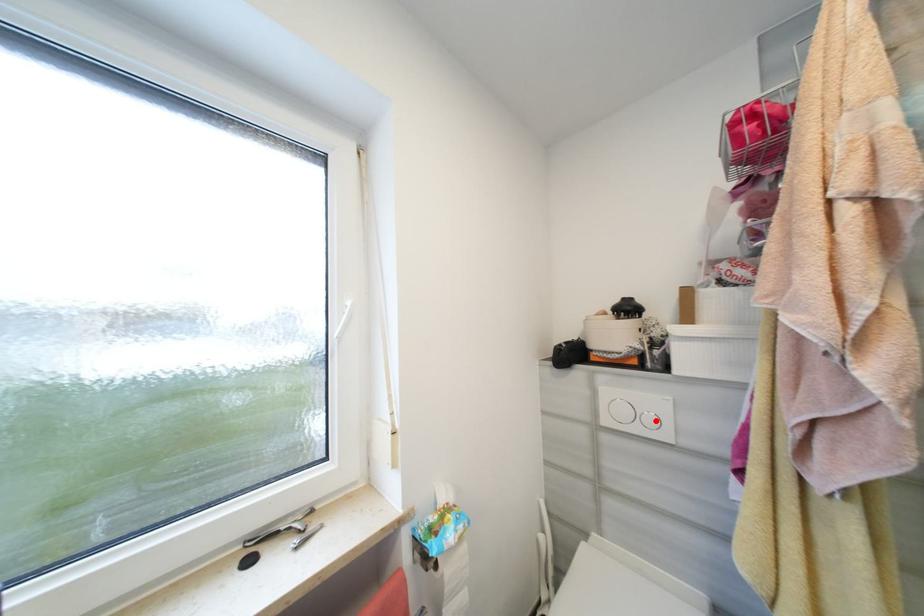
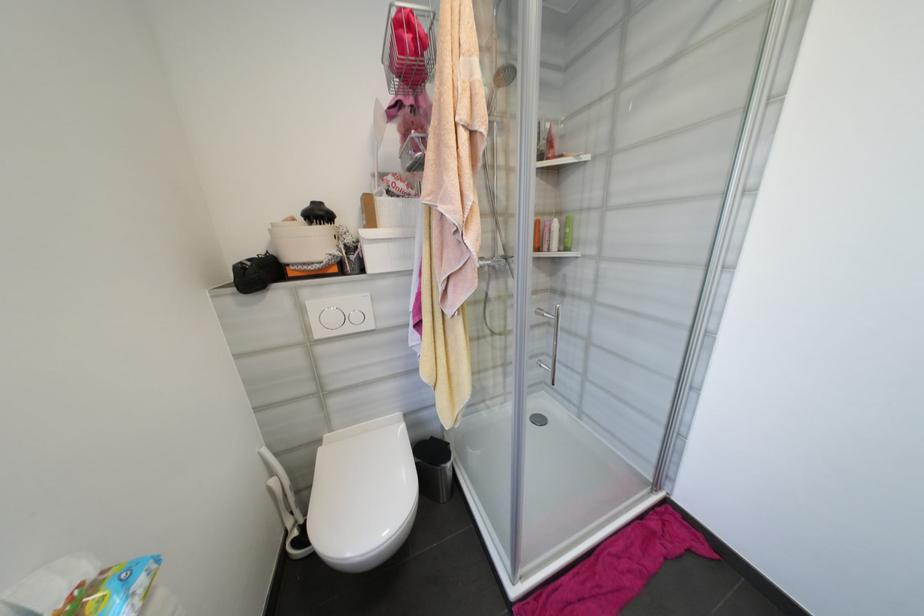
Question: A red point is marked in image1. In image2, is the corresponding 3D point closer to the camera or farther? Reply with the corresponding letter.

Choices:
 (A) The corresponding 3D point is closer.
 (B) The corresponding 3D point is farther.

Answer: (A)